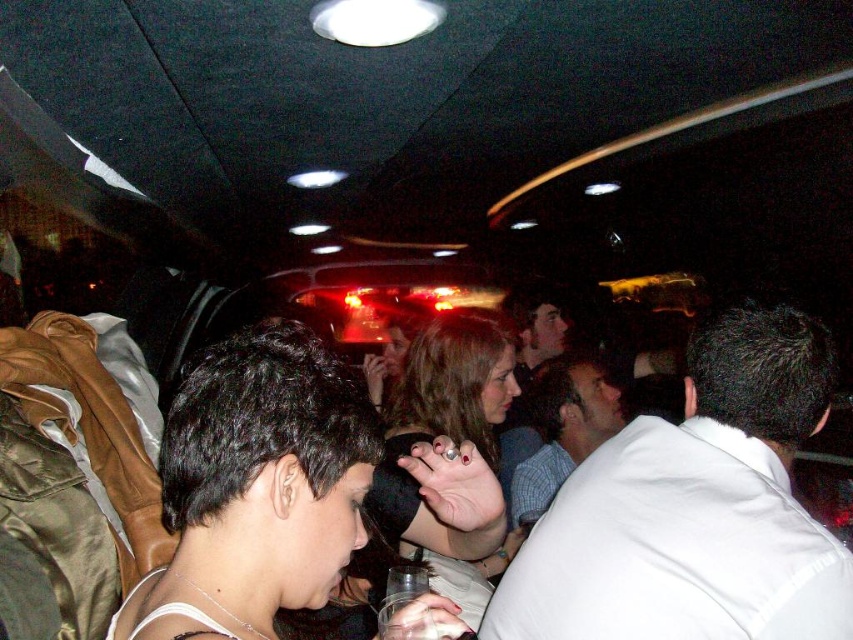
You are a photographer trying to capture a clear shot of both the white cotton shirt at center and the white shirt at center. Which one should you focus on to ensure it appears sharp in the photo?

The white cotton shirt at center is closer to the viewer, so focusing on it will ensure it appears sharp. However, the white shirt at center may appear blurry due to its distance from the camera.

You are a photographer trying to capture a clear shot of both the white cotton shirt at center and the white shirt at center. Since they are both white, you need to distinguish their positions. Which one is on the right side?

The white cotton shirt at center is positioned on the right side of white shirt at center.